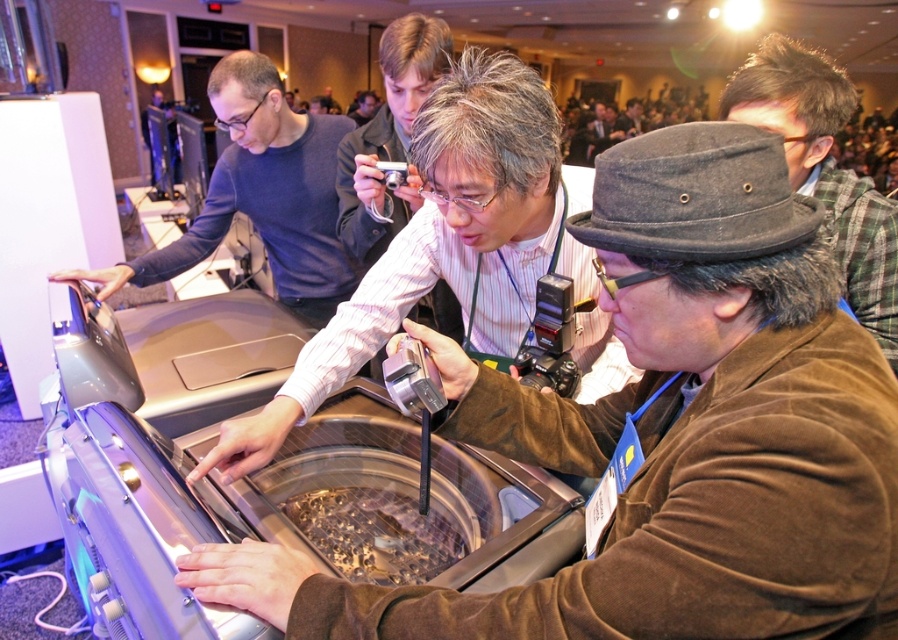
What object is located at the coordinates point [447,243]?

The point [447,243] corresponds to the matte black shirt at center.

You are a photographer at a trade show and need to capture both the matte black shirt at center and the shiny metallic food at center in your frame. Which object should you focus on first if you want to ensure both are in focus, considering their sizes?

The matte black shirt at center has a larger size compared to shiny metallic food at center, so you should focus on the matte black shirt at center first to ensure both are in focus.

You are standing at point (313, 198). The camera is 2.21 meters away from you. Which direction should you move to get closer to the camera?

Since the camera is 2.21 meters away from you at point (313, 198), you should move towards the camera to reduce the distance between you and the camera.